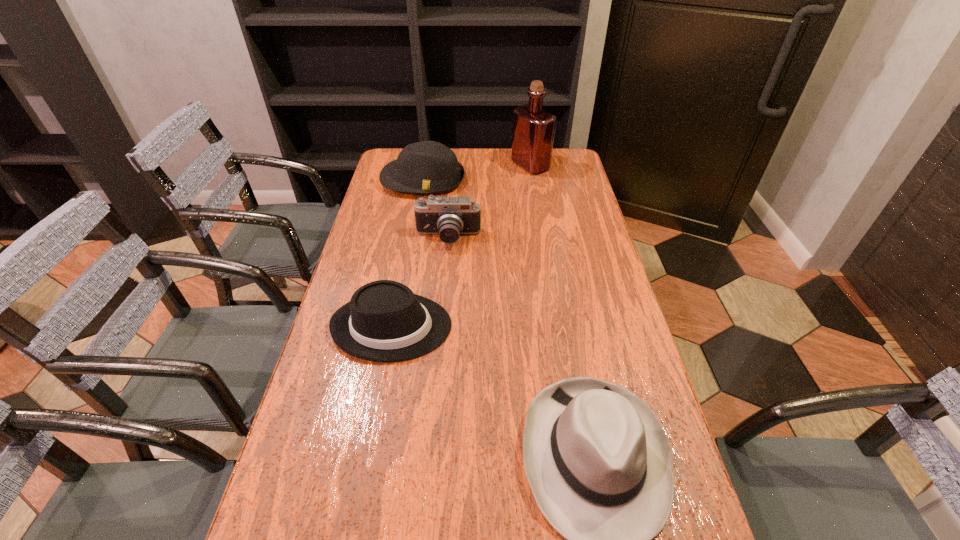
Identify the location of the tallest object. The width and height of the screenshot is (960, 540). (533, 128).

Locate an element on the screen. the farthest fedora is located at coordinates (428, 167).

Where is `camera`? This screenshot has height=540, width=960. camera is located at coordinates (449, 217).

Find the location of a particular element. The image size is (960, 540). the second nearest fedora is located at coordinates (384, 321).

Find the location of a particular element. blank space located 0.190m on the front of the tallest object is located at coordinates (537, 204).

This screenshot has width=960, height=540. I want to click on vacant space located 0.100m on the front-facing side of the farthest fedora, so click(x=417, y=215).

Identify the location of free space located on the front-facing side of the camera. The height and width of the screenshot is (540, 960). (444, 289).

Where is `free space located 0.290m on the front-facing side of the second farthest fedora`? This screenshot has width=960, height=540. free space located 0.290m on the front-facing side of the second farthest fedora is located at coordinates (561, 327).

Find the location of a particular element. liquor that is at the far edge is located at coordinates (533, 128).

Locate an element on the screen. The width and height of the screenshot is (960, 540). fedora present at the far edge is located at coordinates (428, 167).